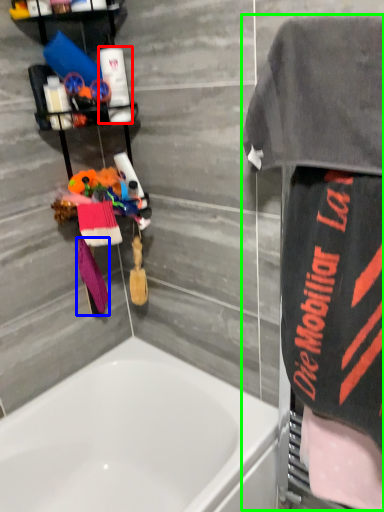
Question: Considering the real-world distances, which object is farthest from toiletry (highlighted by a red box)? beach towel (highlighted by a blue box) or bathrobe (highlighted by a green box)?

Choices:
 (A) beach towel
 (B) bathrobe

Answer: (B)